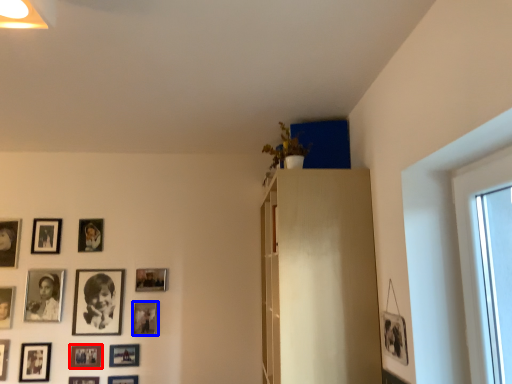
Question: Which point is further to the camera, picture frame (highlighted by a red box) or picture frame (highlighted by a blue box)?

Choices:
 (A) picture frame
 (B) picture frame

Answer: (B)